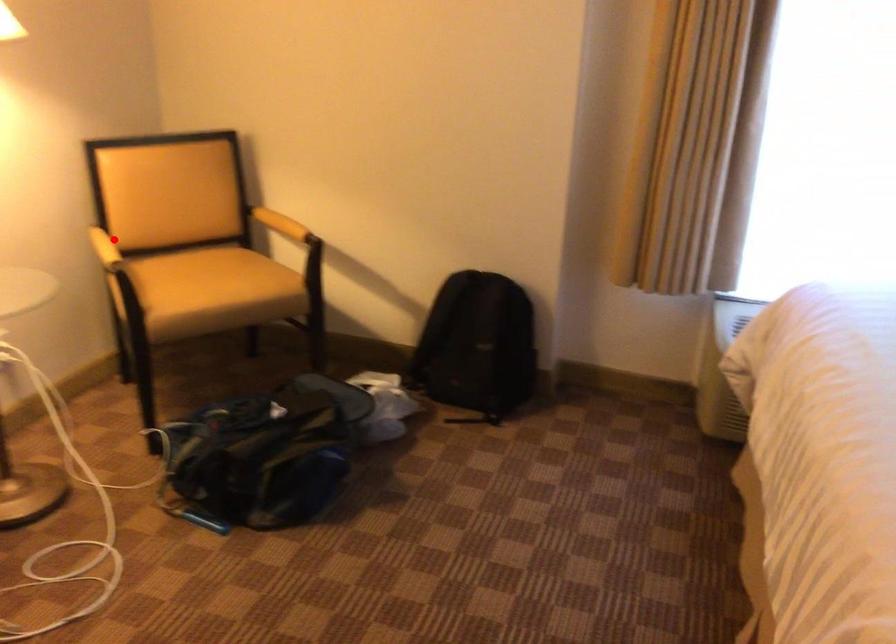
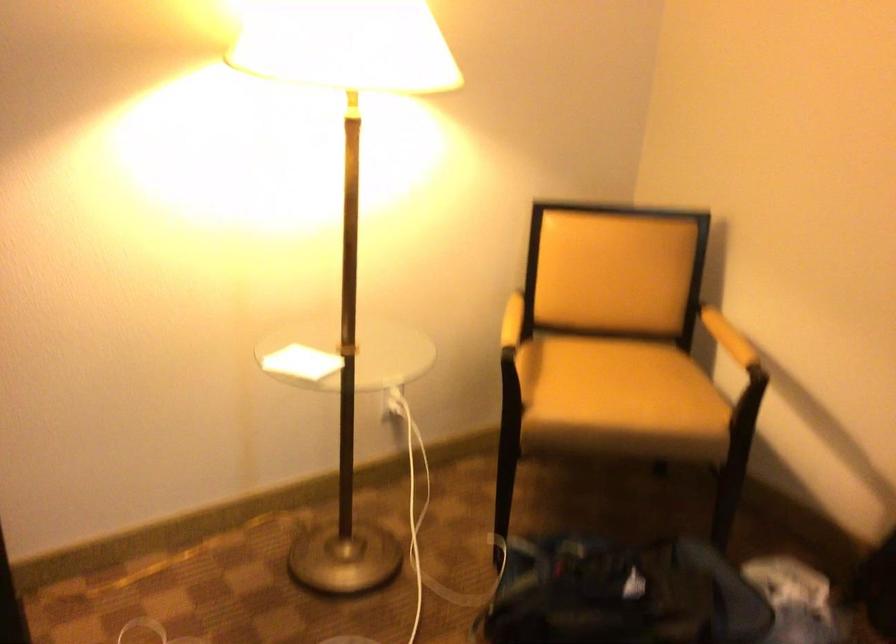
Find the pixel in the second image that matches the highlighted location in the first image.

(512, 321)